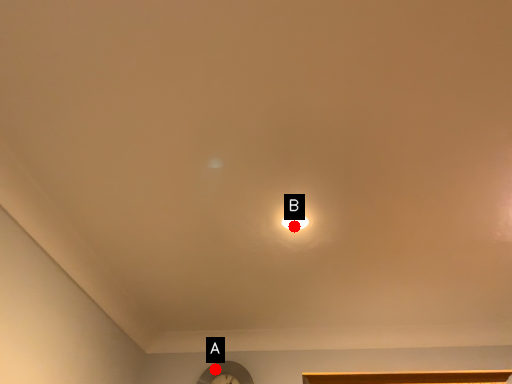
Question: Two points are circled on the image, labeled by A and B beside each circle. Which point is farther from the camera taking this photo?

Choices:
 (A) A is further
 (B) B is further

Answer: (A)